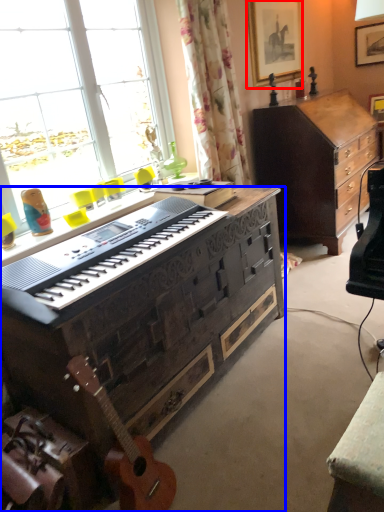
Question: Which object is closer to the camera taking this photo, picture frame (highlighted by a red box) or desk (highlighted by a blue box)?

Choices:
 (A) picture frame
 (B) desk

Answer: (B)